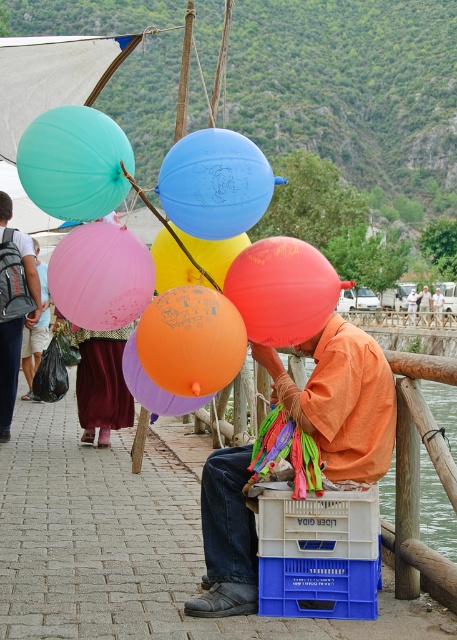
Question: Estimate the real-world distances between objects in this image. Which object is closer to the blue rubber balloon at center?

Choices:
 (A) translucent yellow balloon at center
 (B) matte teal balloon at upper left
 (C) orange matte shirt at center

Answer: (A)

Question: Among these objects, which one is nearest to the camera?

Choices:
 (A) orange matte balloon at center
 (B) purple rubber balloon at center

Answer: (A)

Question: Does matte teal balloon at upper left lie in front of pink rubber balloon at center?

Choices:
 (A) yes
 (B) no

Answer: (A)

Question: Estimate the real-world distances between objects in this image. Which object is farther from the pink rubber balloon at center?

Choices:
 (A) matte teal balloon at upper left
 (B) translucent yellow balloon at center
 (C) orange matte balloon at center
 (D) purple rubber balloon at center

Answer: (A)

Question: Can you confirm if orange matte balloon at center is positioned above translucent yellow balloon at center?

Choices:
 (A) no
 (B) yes

Answer: (A)

Question: Is orange matte shirt at center bigger than pink rubber balloon at center?

Choices:
 (A) no
 (B) yes

Answer: (B)